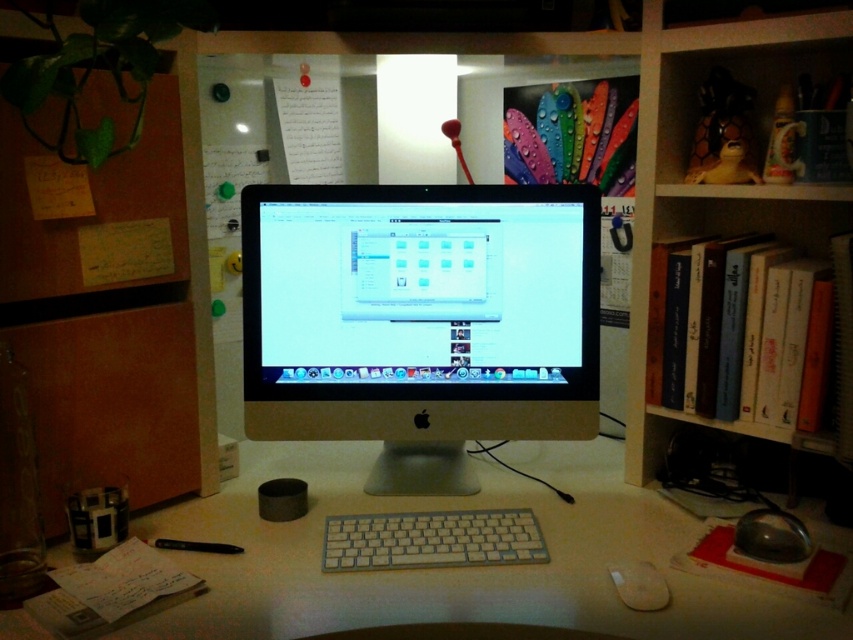
Between point (561, 529) and point (637, 588), which one is positioned in front?

Point (637, 588) is more forward.

The image size is (853, 640). Describe the element at coordinates (456, 566) in the screenshot. I see `white plastic computer desk at center` at that location.

Which is behind, point (183, 561) or point (630, 588)?

The point (183, 561) is behind.

You are a GUI agent. You are given a task and a screenshot of the screen. Output one action in this format:
    pyautogui.click(x=<x>, y=<y>)
    Task: Click on the white plastic computer desk at center
    
    Given the screenshot: What is the action you would take?
    pyautogui.click(x=456, y=566)

Who is shorter, hardcover books at right or burlap paper at left?

With less height is burlap paper at left.

This screenshot has height=640, width=853. What do you see at coordinates (717, 186) in the screenshot?
I see `hardcover books at right` at bounding box center [717, 186].

Find the location of a particular element. Image resolution: width=853 pixels, height=640 pixels. hardcover books at right is located at coordinates (717, 186).

Between point (788, 189) and point (476, 556), which one is positioned in front?

Point (476, 556)

Which is in front, point (813, 60) or point (465, 554)?

Point (465, 554) is in front.

Find the location of a particular element. This screenshot has height=640, width=853. hardcover books at right is located at coordinates (717, 186).